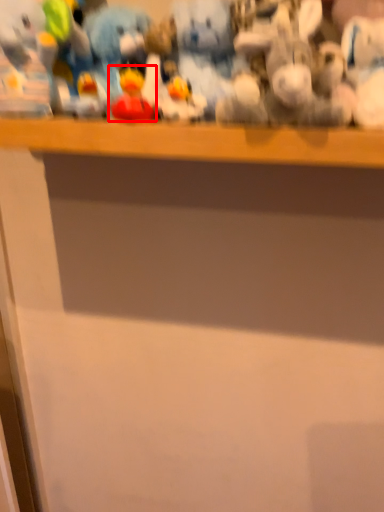
Question: Observing the image, what is the correct spatial positioning of toy (annotated by the red box) in reference to toy?

Choices:
 (A) left
 (B) right

Answer: (A)